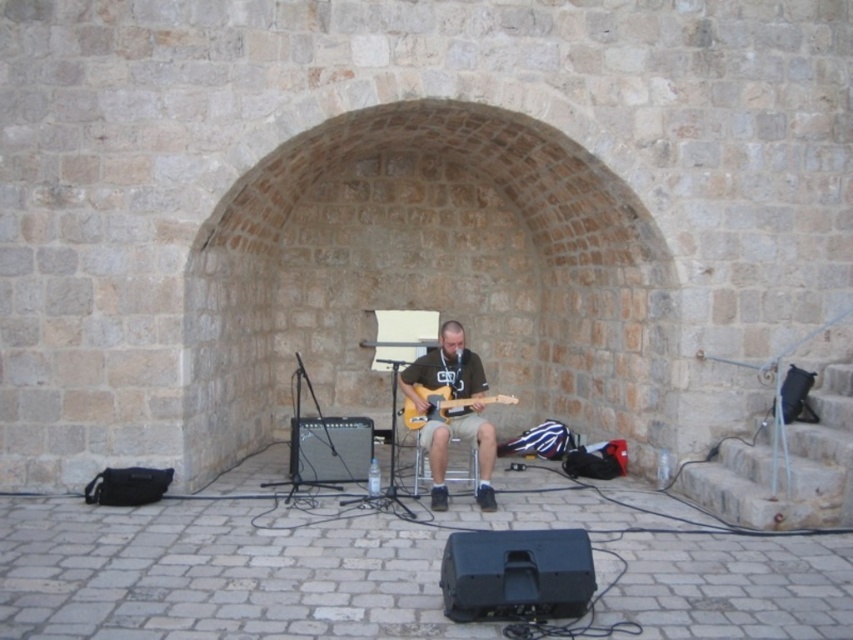
Question: Observing the image, what is the correct spatial positioning of matte black guitar at center in reference to light wood electric guitar at center?

Choices:
 (A) above
 (B) below

Answer: (B)

Question: Which of the following is the closest to the observer?

Choices:
 (A) (408, 419)
 (B) (469, 426)

Answer: (B)

Question: Is matte black guitar at center to the right of light wood electric guitar at center from the viewer's perspective?

Choices:
 (A) no
 (B) yes

Answer: (A)

Question: Can you confirm if matte black guitar at center is bigger than light wood electric guitar at center?

Choices:
 (A) yes
 (B) no

Answer: (A)